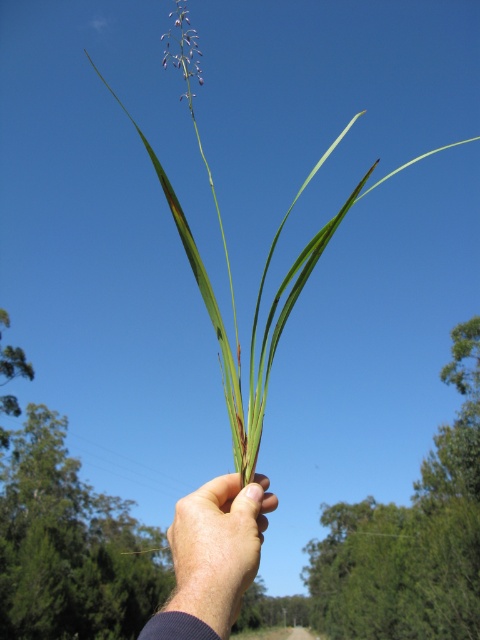
Which is in front, point (253, 492) or point (178, 28)?

Point (178, 28)

Is skinny green leaf at center wider than purple matte flower at upper center?

No.

Which is behind, point (217, 561) or point (193, 29)?

Positioned behind is point (193, 29).

Where is `skinny green leaf at center`? skinny green leaf at center is located at coordinates pyautogui.click(x=217, y=547).